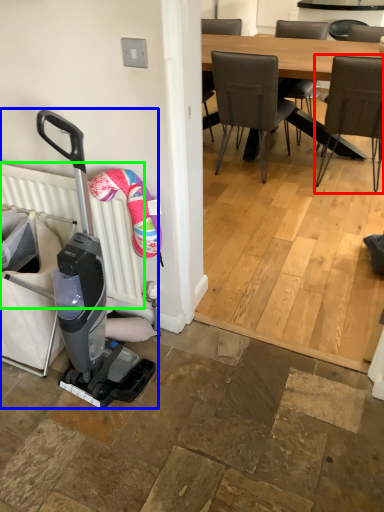
Question: Estimate the real-world distances between objects in this image. Which object is closer to chair (highlighted by a red box), baby carriage (highlighted by a blue box) or radiator (highlighted by a green box)?

Choices:
 (A) baby carriage
 (B) radiator

Answer: (B)